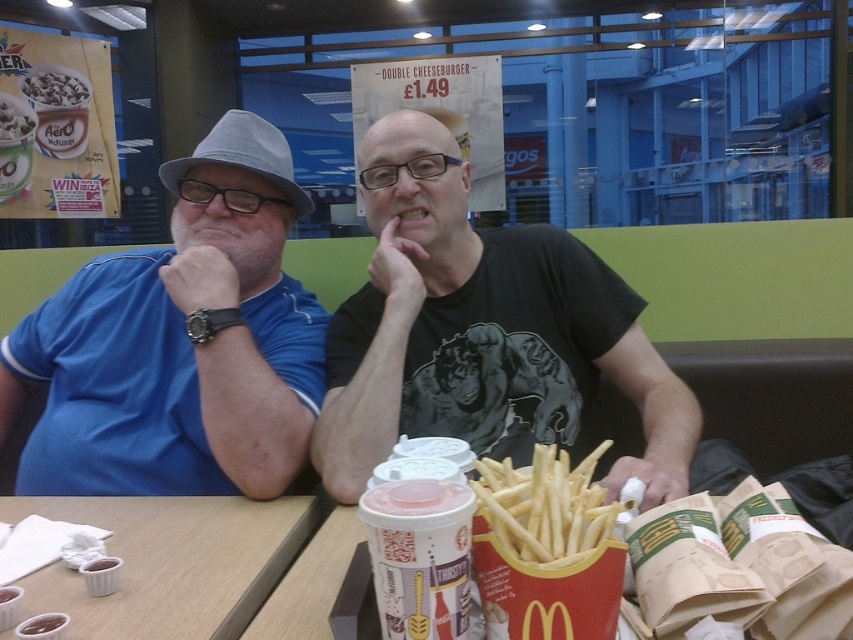
Does black matte t-shirt at center have a lesser width compared to white paper cups at lower left?

No.

Between black matte t-shirt at center and white paper cups at lower left, which one has more height?

With more height is black matte t-shirt at center.

Between point (405, 109) and point (241, 573), which one is positioned behind?

The point (405, 109) is more distant.

Where is `black matte t-shirt at center`? black matte t-shirt at center is located at coordinates (480, 330).

Is point (489, 236) more distant than point (428, 602)?

Yes.

Does point (422, 419) come in front of point (367, 540)?

That is False.

I want to click on black matte t-shirt at center, so click(x=480, y=330).

Is black matte t-shirt at center wider than smooth white cereal at upper left?

Yes, black matte t-shirt at center is wider than smooth white cereal at upper left.

Can you confirm if black matte t-shirt at center is thinner than smooth white cereal at upper left?

Incorrect, black matte t-shirt at center's width is not less than smooth white cereal at upper left's.

Is point (409, 227) positioned after point (80, 84)?

That is False.

Image resolution: width=853 pixels, height=640 pixels. What are the coordinates of `black matte t-shirt at center` in the screenshot? It's located at (480, 330).